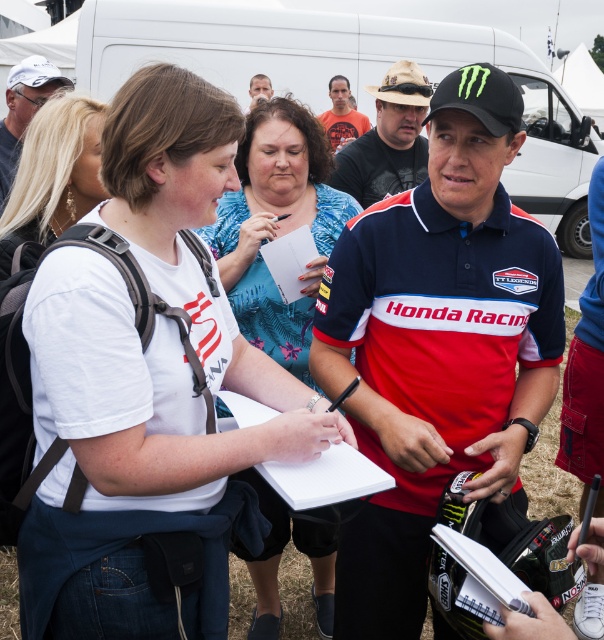
Between black cotton shirt at center and white matte cap at upper left, which one appears on the left side from the viewer's perspective?

Positioned to the left is white matte cap at upper left.

Which is behind, point (381, 124) or point (16, 92)?

Point (16, 92)

Who is more distant from viewer, (402, 134) or (5, 195)?

The point (402, 134) is behind.

You are a GUI agent. You are given a task and a screenshot of the screen. Output one action in this format:
    pyautogui.click(x=<x>, y=<y>)
    Task: Click on the black cotton shirt at center
    
    Given the screenshot: What is the action you would take?
    pyautogui.click(x=387, y=140)

Between point (275, 148) and point (262, 99), which one is positioned in front?

Positioned in front is point (275, 148).

Image resolution: width=604 pixels, height=640 pixels. What do you see at coordinates (277, 227) in the screenshot?
I see `white fabric shirt at center` at bounding box center [277, 227].

The width and height of the screenshot is (604, 640). What are the coordinates of `white fabric shirt at center` in the screenshot? It's located at (277, 227).

Is white matte cap at upper left wider than orange t-shirt at center?

No.

Can you confirm if white matte cap at upper left is positioned to the left of orange t-shirt at center?

Yes, white matte cap at upper left is to the left of orange t-shirt at center.

Does point (36, 54) lie behind point (335, 104)?

No, it is not.

Identify the location of white matte cap at upper left. The image size is (604, 640). click(24, 109).